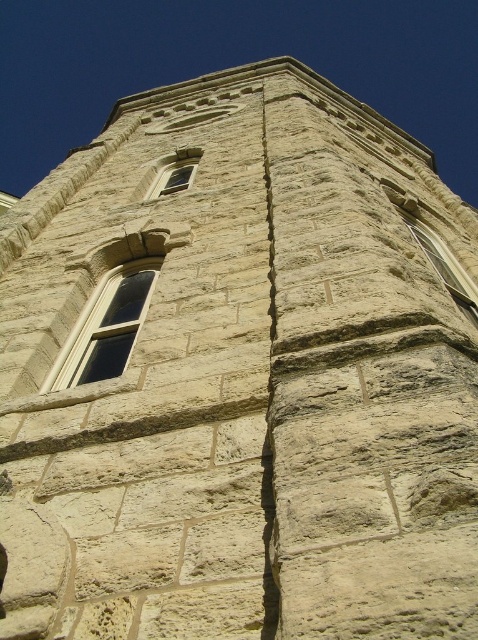
You are an architect assessing the stone building. You need to determine which window has a greater width between the clear glass window at center and the clear stone window at upper right. Based on the scene, which one is wider?

The clear glass window at center is wider than the clear stone window at upper right according to the description.

You are an architect examining the stone building. You need to determine which window has a narrower frame between the clear stone window at upper right and the matte stone window at upper center. Which one is it?

The clear stone window at upper right has a narrower frame because it is thinner than the matte stone window at upper center.